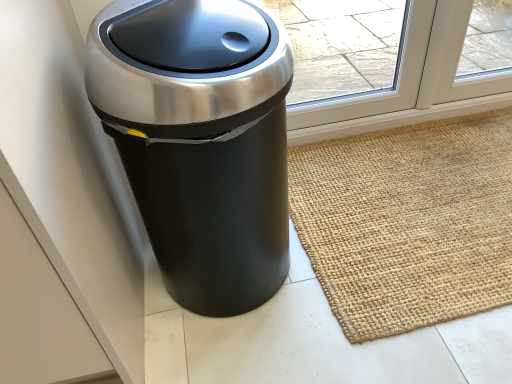
What are the coordinates of `spots to the right of satin black trash can at left` in the screenshot? It's located at (365, 256).